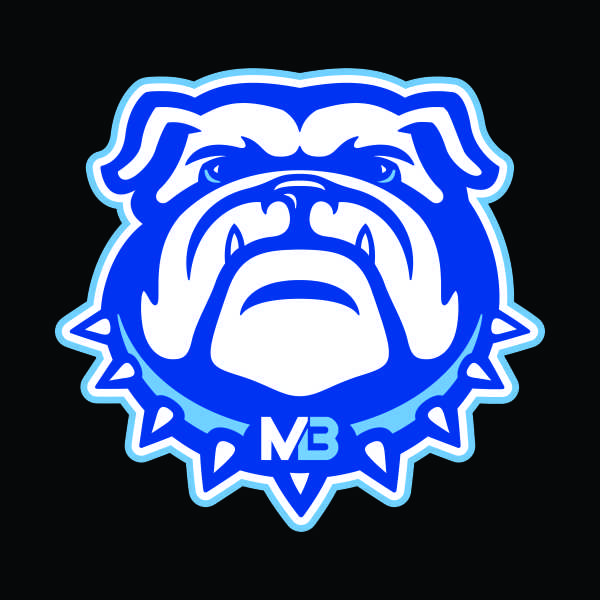
This screenshot has height=600, width=600. Identify the location of artwork. (424, 350).